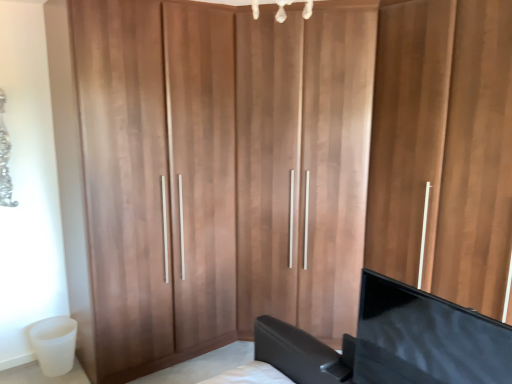
Question: Is wooden wardrobe at center at the left side of black glossy tv at lower right?

Choices:
 (A) no
 (B) yes

Answer: (A)

Question: From the image's perspective, is wooden wardrobe at center under black glossy tv at lower right?

Choices:
 (A) no
 (B) yes

Answer: (A)

Question: Is black glossy tv at lower right completely or partially inside wooden wardrobe at center?

Choices:
 (A) no
 (B) yes

Answer: (A)

Question: Is wooden wardrobe at center positioned beyond the bounds of black glossy tv at lower right?

Choices:
 (A) yes
 (B) no

Answer: (A)

Question: From a real-world perspective, is wooden wardrobe at center located beneath black glossy tv at lower right?

Choices:
 (A) yes
 (B) no

Answer: (B)

Question: Can you confirm if wooden wardrobe at center is bigger than black glossy tv at lower right?

Choices:
 (A) no
 (B) yes

Answer: (B)

Question: Could you tell me if black glossy tv at lower right is turned towards wooden wardrobe at center?

Choices:
 (A) yes
 (B) no

Answer: (B)

Question: Can you confirm if black glossy tv at lower right is taller than wooden wardrobe at center?

Choices:
 (A) no
 (B) yes

Answer: (A)

Question: Is wooden wardrobe at center surrounded by black glossy tv at lower right?

Choices:
 (A) no
 (B) yes

Answer: (A)

Question: From the image's perspective, is black glossy tv at lower right located beneath wooden wardrobe at center?

Choices:
 (A) yes
 (B) no

Answer: (A)

Question: Does black glossy tv at lower right have a smaller size compared to wooden wardrobe at center?

Choices:
 (A) no
 (B) yes

Answer: (B)

Question: Considering the relative sizes of black glossy tv at lower right and wooden wardrobe at center in the image provided, is black glossy tv at lower right wider than wooden wardrobe at center?

Choices:
 (A) no
 (B) yes

Answer: (A)

Question: Is wooden wardrobe at center spatially inside black glossy tv at lower right, or outside of it?

Choices:
 (A) inside
 (B) outside

Answer: (B)